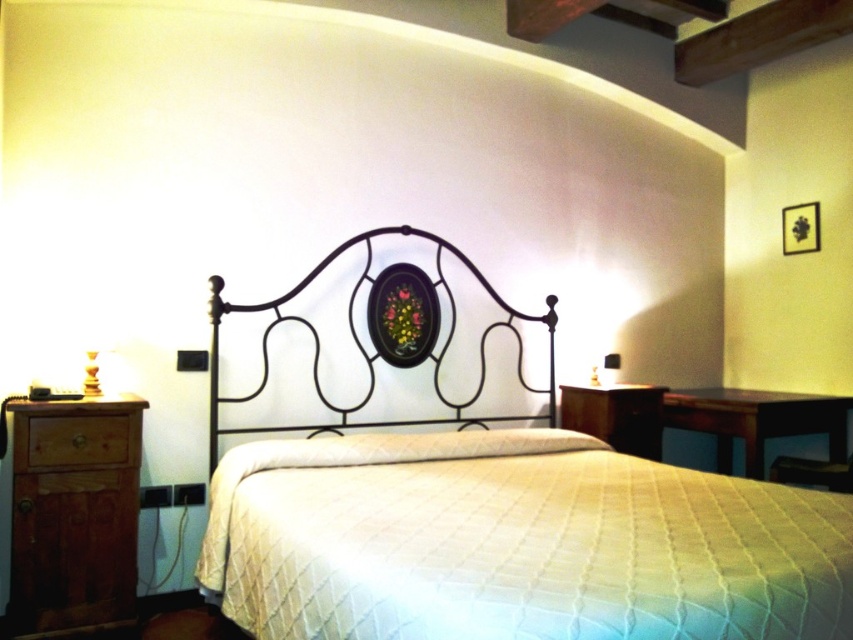
You are standing in the bedroom and want to place a new nightstand. The current nightstands are on both sides of the white quilted bed at center. Where should you place the new nightstand to maintain symmetry?

To maintain symmetry, the new nightstand should be placed on the opposite side of the existing nightstands relative to the white quilted bed at center, ensuring it is equidistant from the bed as the existing ones.

You are organizing a small party in the bedroom and need to move a decorative vase from the brown wood dresser at left to the white quilted pillow at center. Which direction should you move the vase to place it on the pillow?

The brown wood dresser at left is positioned on the left side of the white quilted pillow at center, so you should move the vase to the right to place it on the white quilted pillow at center.

You are a painter who needs to hang a large painting on the wall behind the white quilted bed at center and the wooden lamp at right. Considering their heights, which object would require a higher hanging position to avoid blocking the view from the bed?

The white quilted bed at center is much taller than the wooden lamp at right, so the painting should be hung higher to avoid blocking the view from the bed.